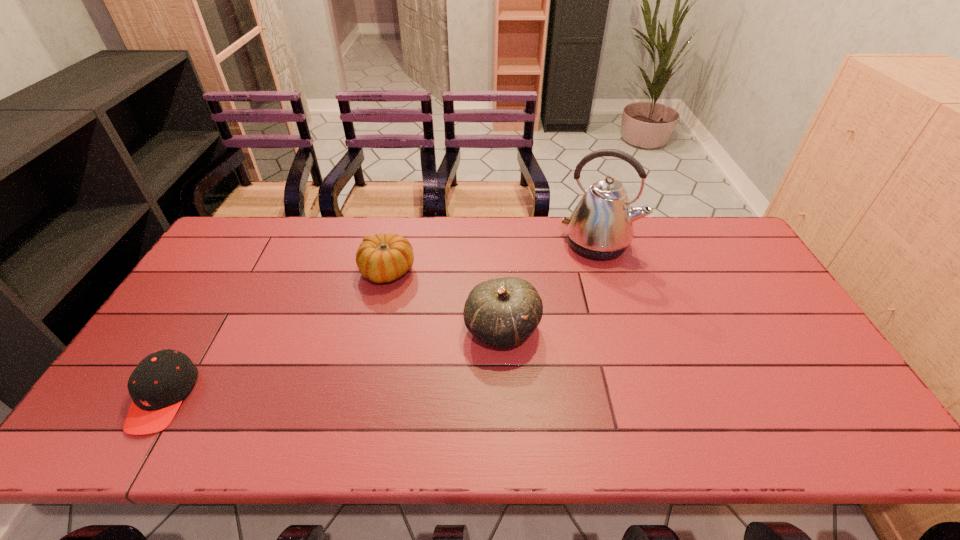
Find the location of a particular element. This screenshot has height=540, width=960. vacant space positioned on the left of the shorter gourd is located at coordinates (296, 271).

Find the location of a particular element. This screenshot has width=960, height=540. kettle that is at the far edge is located at coordinates [601, 226].

Find the location of a particular element. The width and height of the screenshot is (960, 540). gourd that is at the far edge is located at coordinates (382, 258).

Locate an element on the screen. This screenshot has width=960, height=540. object at the near edge is located at coordinates (158, 384).

Where is `object that is positioned at the left edge`? Image resolution: width=960 pixels, height=540 pixels. object that is positioned at the left edge is located at coordinates (158, 384).

You are a GUI agent. You are given a task and a screenshot of the screen. Output one action in this format:
    pyautogui.click(x=<x>, y=<y>)
    Task: Click on the object that is at the near left corner
    The height and width of the screenshot is (540, 960).
    Given the screenshot: What is the action you would take?
    pyautogui.click(x=158, y=384)

You are a GUI agent. You are given a task and a screenshot of the screen. Output one action in this format:
    pyautogui.click(x=<x>, y=<y>)
    Task: Click on the vacant space at the far edge
    The width and height of the screenshot is (960, 540).
    Given the screenshot: What is the action you would take?
    pyautogui.click(x=304, y=229)

Identify the location of vacant space at the near edge of the desktop. (365, 423).

Identify the location of vacant space at the left edge of the desktop. This screenshot has height=540, width=960. (209, 269).

What are the coordinates of `free space at the right edge of the desktop` in the screenshot? It's located at (799, 408).